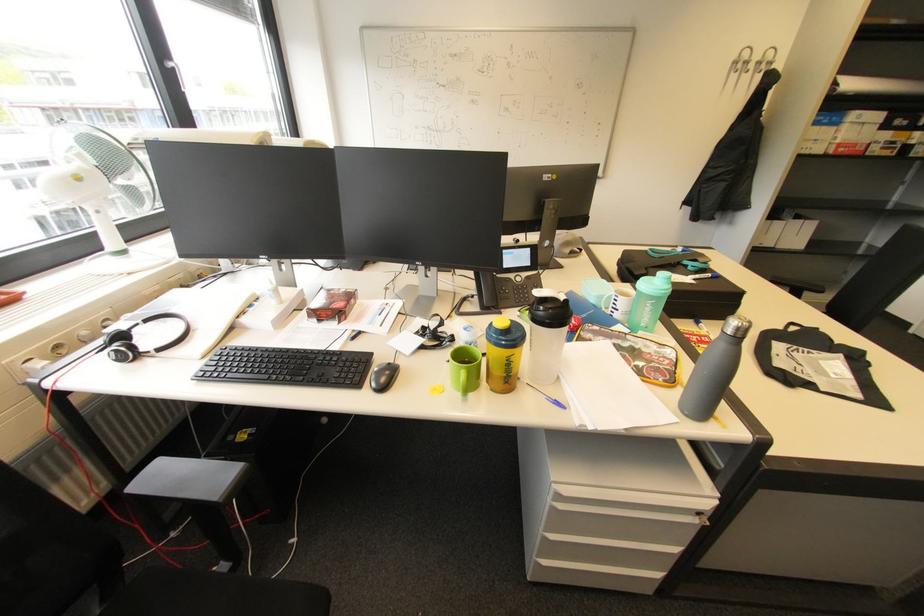
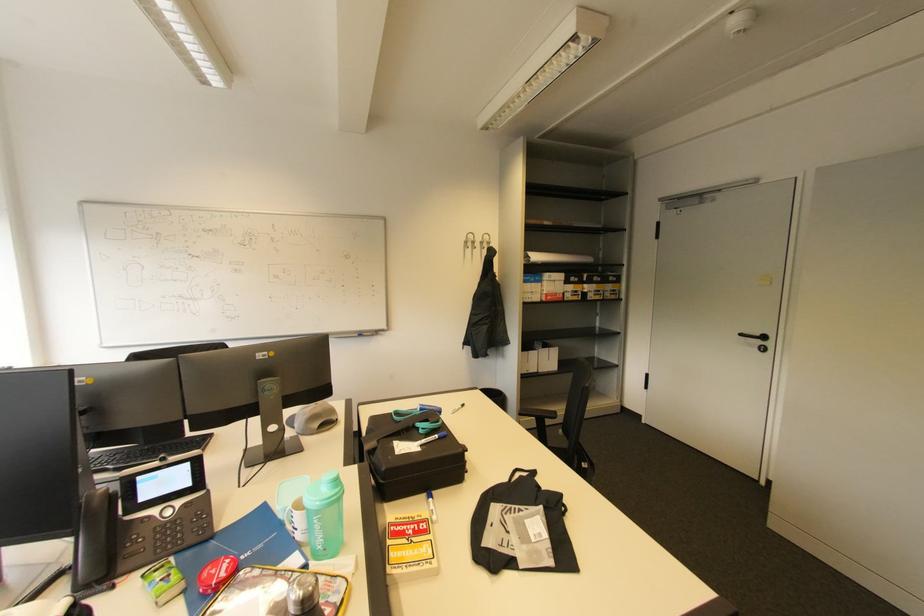
The point at (572, 252) is marked in the first image. Where is the corresponding point in the second image?

(321, 426)